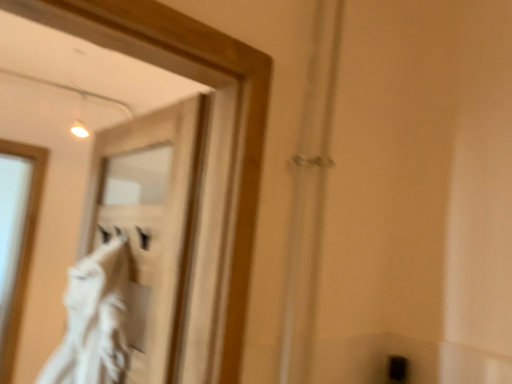
This screenshot has height=384, width=512. Describe the element at coordinates (148, 221) in the screenshot. I see `clear glass screen door at upper left` at that location.

Locate an element on the screen. This screenshot has width=512, height=384. clear glass screen door at upper left is located at coordinates [148, 221].

Locate an element on the screen. The image size is (512, 384). clear glass screen door at upper left is located at coordinates (148, 221).